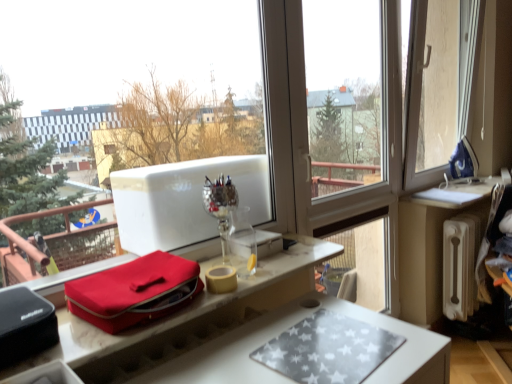
You are a GUI agent. You are given a task and a screenshot of the screen. Output one action in this format:
    pyautogui.click(x=<x>, y=<y>)
    Task: Click on the vacant region to the right of blue fabric iron at upper right
    This screenshot has height=384, width=512.
    Given the screenshot: What is the action you would take?
    pyautogui.click(x=489, y=179)